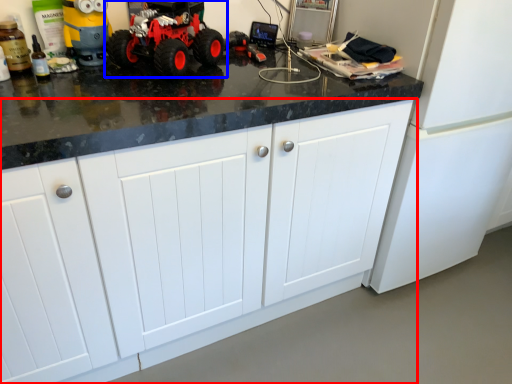
Question: Which object appears closest to the camera in this image, cabinetry (highlighted by a red box) or land vehicle (highlighted by a blue box)?

Choices:
 (A) cabinetry
 (B) land vehicle

Answer: (A)